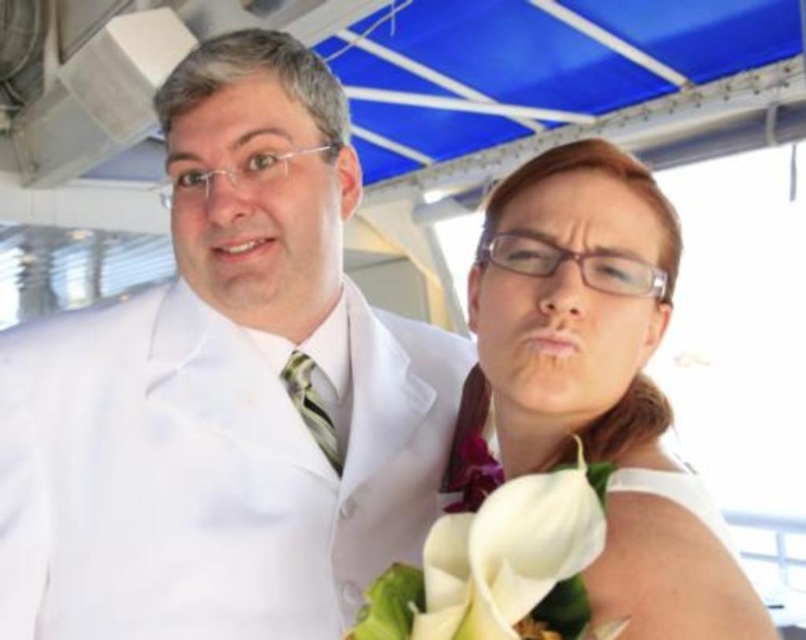
You are taking a photo of the two people under the blue canopy. You want to focus on the person closer to the camera. Which point should you focus on, point [672,564] or point [572,477]?

Point [672,564] is further to the camera than point [572,477]. Therefore, to focus on the person closer to the camera, you should focus on point [572,477].

You are a photographer at a wedding and need to capture a photo of the white matte suit at center and the white matte calla lilies at center. If you want to ensure both are fully visible in the frame, which object should you focus on first?

The white matte suit at center is taller than the white matte calla lilies at center, so you should focus on the white matte suit at center first to ensure the entire height of the suit is captured before adjusting for the lilies.